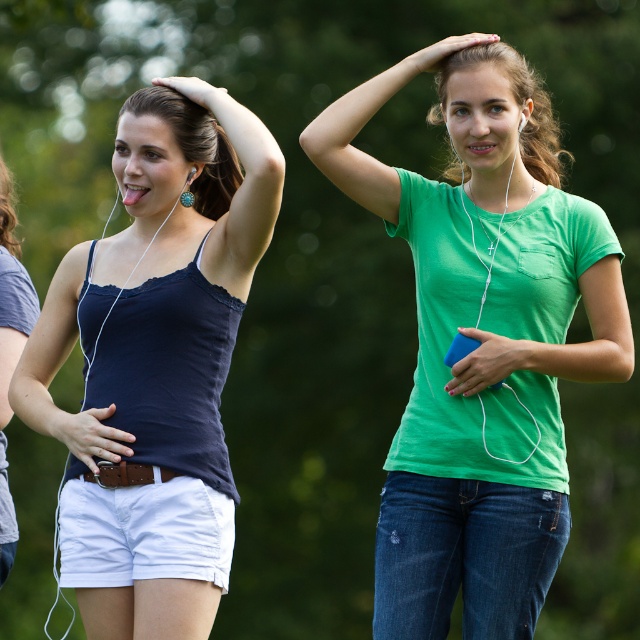
At what (x,y) coordinates should I click in order to perform the action: click on matte black tank top at left. Please return your answer as a coordinate pair (x, y). Looking at the image, I should click on (156, 362).

Between matte black tank top at left and white cotton shorts at lower left, which one appears on the right side from the viewer's perspective?

matte black tank top at left

At what (x,y) coordinates should I click in order to perform the action: click on matte black tank top at left. Please return your answer as a coordinate pair (x, y). Looking at the image, I should click on (156, 362).

Is green cotton shirt at center wider than matte black tank top at left?

Correct, the width of green cotton shirt at center exceeds that of matte black tank top at left.

Can you confirm if green cotton shirt at center is taller than matte black tank top at left?

Correct, green cotton shirt at center is much taller as matte black tank top at left.

Describe the element at coordinates (481, 342) in the screenshot. I see `green cotton shirt at center` at that location.

Locate an element on the screen. Image resolution: width=640 pixels, height=640 pixels. green cotton shirt at center is located at coordinates (481, 342).

Is green cotton shirt at center further to camera compared to white cotton shorts at lower left?

Yes, green cotton shirt at center is further from the viewer.

Can you confirm if green cotton shirt at center is positioned above white cotton shorts at lower left?

Indeed, green cotton shirt at center is positioned over white cotton shorts at lower left.

Does point (376, 528) come closer to viewer compared to point (86, 536)?

No, it is not.

At what (x,y) coordinates should I click in order to perform the action: click on green cotton shirt at center. Please return your answer as a coordinate pair (x, y). This screenshot has height=640, width=640. Looking at the image, I should click on (481, 342).